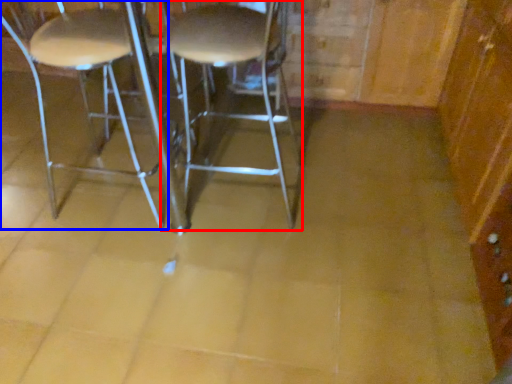
Question: Which of the following is the closest to the observer, stool (highlighted by a red box) or chair (highlighted by a blue box)?

Choices:
 (A) stool
 (B) chair

Answer: (A)